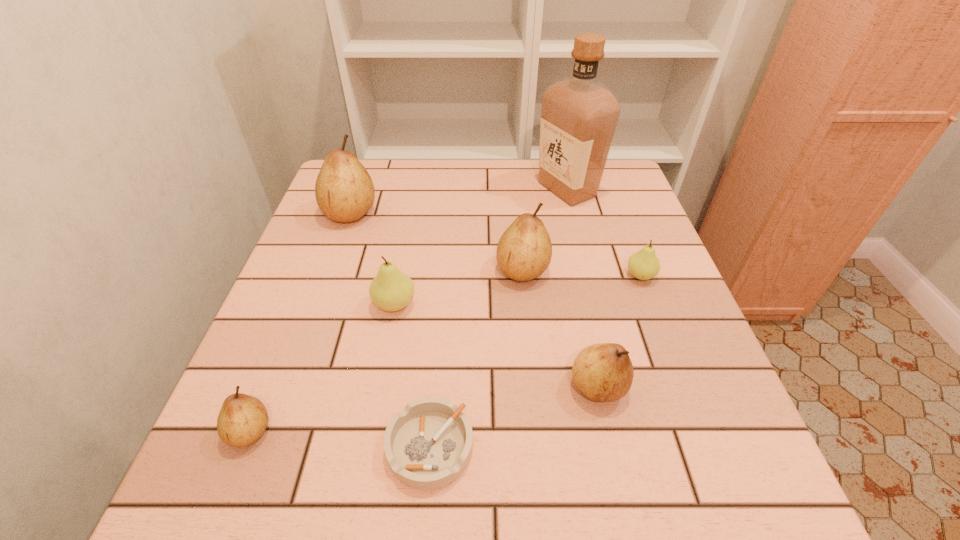
You are a GUI agent. You are given a task and a screenshot of the screen. Output one action in this format:
    pyautogui.click(x=<x>, y=<y>)
    Task: Click on the free space located 0.090m on the left of the second smallest brown pear
    Image resolution: width=960 pixels, height=540 pixels.
    Given the screenshot: What is the action you would take?
    pyautogui.click(x=517, y=387)

What are the coordinates of `vacant area located on the back of the right green pear` in the screenshot? It's located at (623, 230).

Identify the location of vacant space located 0.100m on the back of the smallest brown pear. The image size is (960, 540). (278, 361).

Where is `vacant space located 0.150m on the left of the ashtray`? vacant space located 0.150m on the left of the ashtray is located at coordinates (292, 447).

Where is `liquor positioned at the far edge`? liquor positioned at the far edge is located at coordinates (579, 114).

Where is `pear that is at the far edge`? This screenshot has width=960, height=540. pear that is at the far edge is located at coordinates (344, 191).

The image size is (960, 540). Find the location of `object situated at the near edge`. object situated at the near edge is located at coordinates (428, 445).

Find the location of `liquor positioned at the right edge`. liquor positioned at the right edge is located at coordinates (579, 114).

Find the location of `pear present at the right edge`. pear present at the right edge is located at coordinates (644, 265).

The height and width of the screenshot is (540, 960). I want to click on object that is at the far left corner, so click(344, 191).